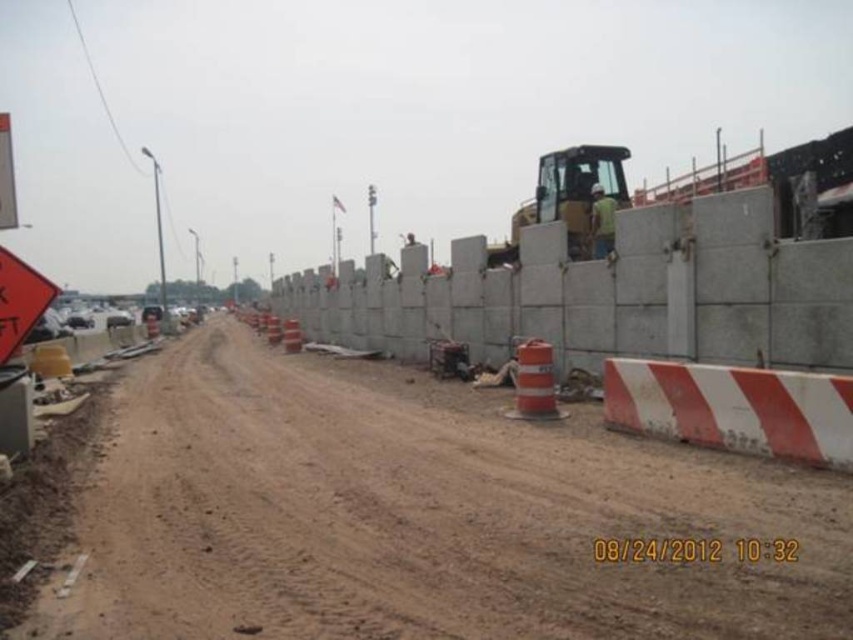
In the scene shown: Is brown dirt track at center to the right of green fabric construction worker at center from the viewer's perspective?

Incorrect, brown dirt track at center is not on the right side of green fabric construction worker at center.

Which is more to the right, brown dirt track at center or green fabric construction worker at center?

Positioned to the right is green fabric construction worker at center.

Is point (784, 586) behind point (614, 202)?

No, it is not.

This screenshot has height=640, width=853. I want to click on brown dirt track at center, so (x=422, y=516).